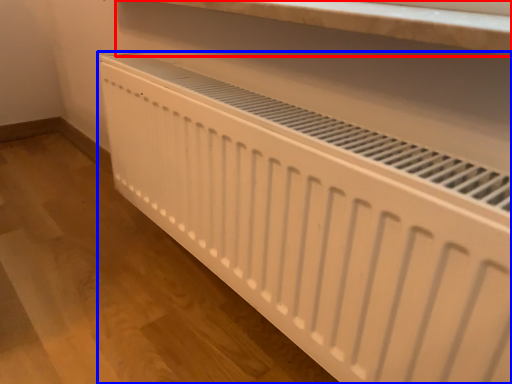
Question: Which of the following is the farthest to the observer, shelf (highlighted by a red box) or home appliance (highlighted by a blue box)?

Choices:
 (A) shelf
 (B) home appliance

Answer: (A)